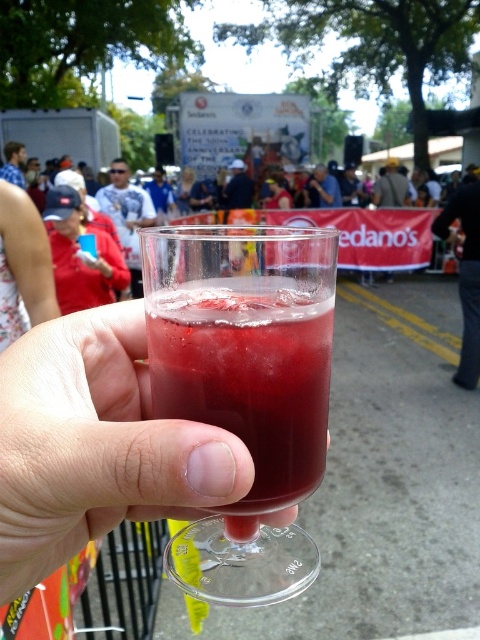
Consider the image. You are at a crowded outdoor event and holding a transparent glass at center and a clear plastic cup at center. You want to place them on a table that can only fit items spaced 1.5 inches apart. Can you place both items on the table without them touching?

The distance between the transparent glass at center and clear plastic cup at center is 1.41 inches, which is less than the required 1.5 inches. Therefore, placing them on the table would cause them to touch, so they cannot be placed without touching.

You are at a festival and holding both the transparent glass at center and the clear plastic cup at center. Which one has a smaller width?

The transparent glass at center has a smaller width compared to the clear plastic cup at center.

You are at a festival and want to take a photo of the crowd without blocking the view of the stemmed glass in your hand. The stemmed glass is at point (239, 230), and there is a person at point (79, 317). Which point should you avoid to keep the glass visible?

You should avoid the point (79, 317) because point (239, 230) is behind it, so blocking the person at (79, 317) would allow the glass at (239, 230) to be visible.